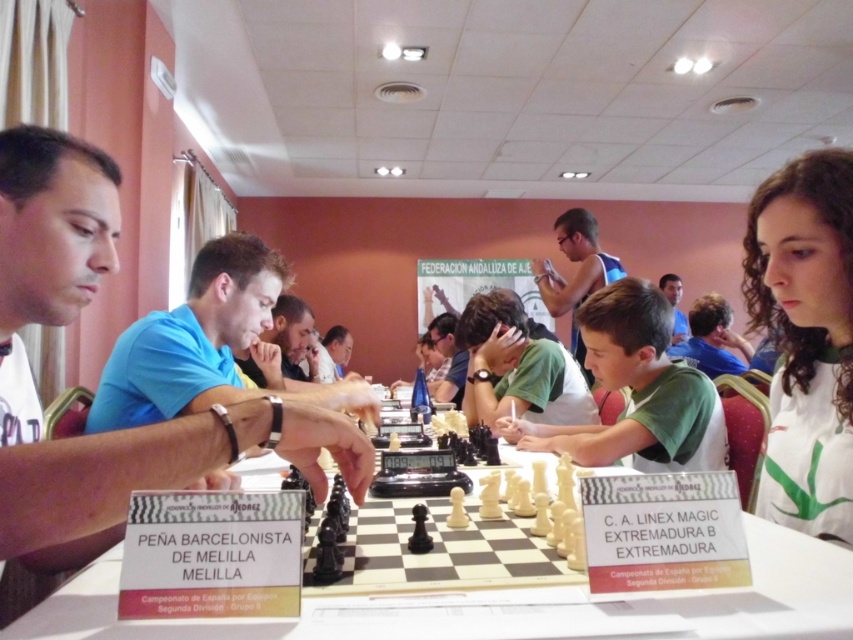
Question: Is white jersey at upper right to the right of smooth brown hair at center from the viewer's perspective?

Choices:
 (A) yes
 (B) no

Answer: (A)

Question: Does green matte shirt at center have a greater width compared to blue tank top at upper center?

Choices:
 (A) no
 (B) yes

Answer: (B)

Question: Does white plastic chessboard at center have a smaller size compared to blue shirt at center?

Choices:
 (A) yes
 (B) no

Answer: (A)

Question: Which point is farther to the camera?

Choices:
 (A) (679, 310)
 (B) (582, 228)

Answer: (A)

Question: Among these objects, which one is farthest from the camera?

Choices:
 (A) white shirt at left
 (B) blue tank top at upper center
 (C) white jersey at upper right
 (D) white plastic chessboard at center

Answer: (B)

Question: Which point is farther from the camera taking this photo?

Choices:
 (A) (672, 275)
 (B) (593, 280)
 (C) (39, 506)

Answer: (A)